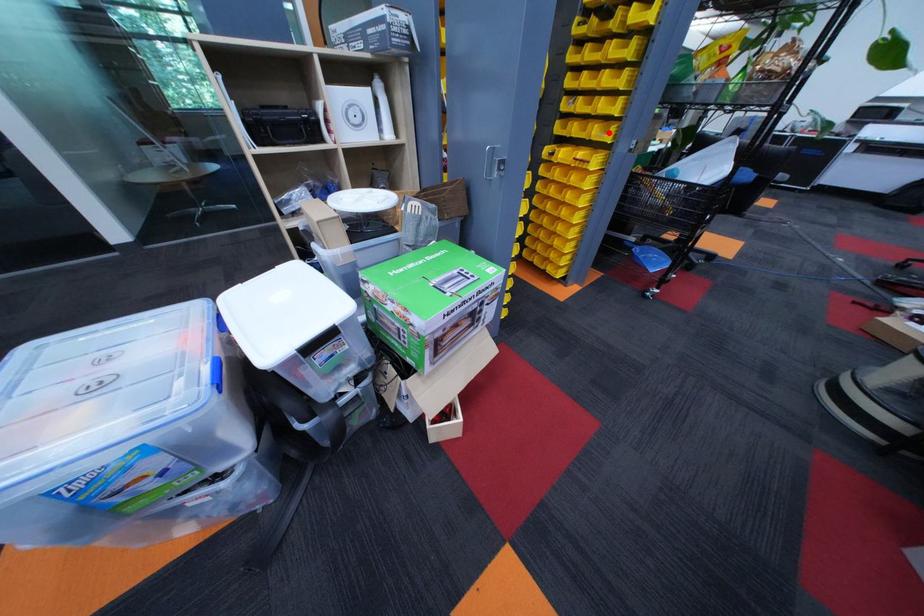
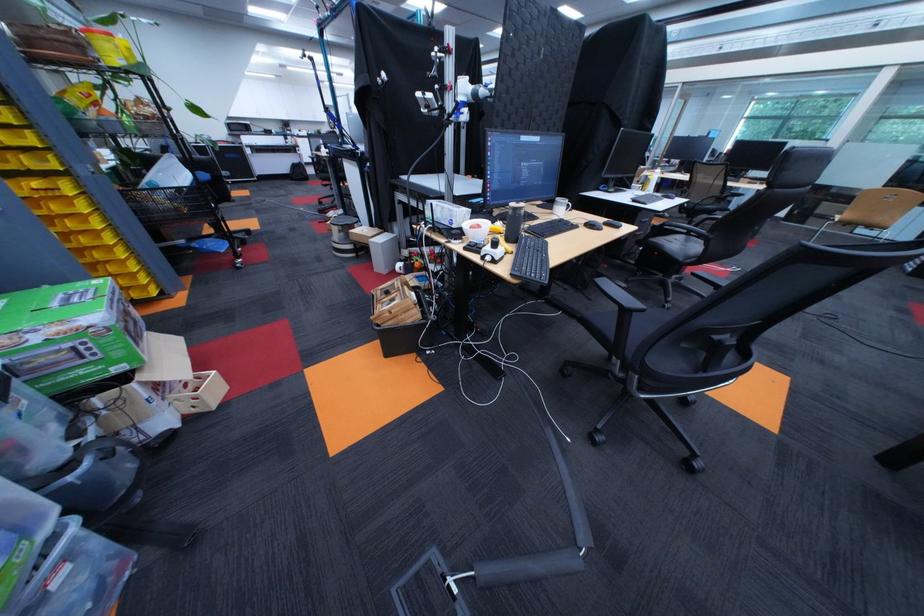
Question: I am providing you with two images of the same scene from different viewpoints. Given a red point in image1, look at the same physical point in image2. Is it:

Choices:
 (A) Closer to the viewpoint
 (B) Farther from the viewpoint

Answer: (B)